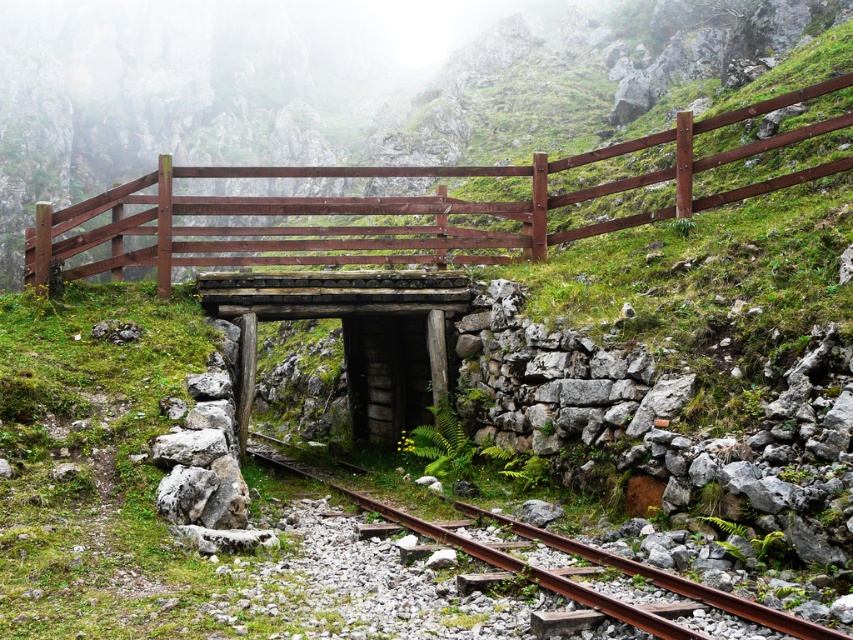
Question: Is brown wooden fence at center to the left of rusty metal train track at center from the viewer's perspective?

Choices:
 (A) yes
 (B) no

Answer: (A)

Question: Which point is farther to the camera?

Choices:
 (A) (347, 492)
 (B) (836, 84)

Answer: (A)

Question: Is brown wooden fence at center thinner than rusty metal train track at center?

Choices:
 (A) yes
 (B) no

Answer: (B)

Question: Can you confirm if brown wooden fence at center is thinner than rusty metal train track at center?

Choices:
 (A) yes
 (B) no

Answer: (B)

Question: Which point is farther from the camera taking this photo?

Choices:
 (A) (578, 541)
 (B) (82, 212)

Answer: (B)